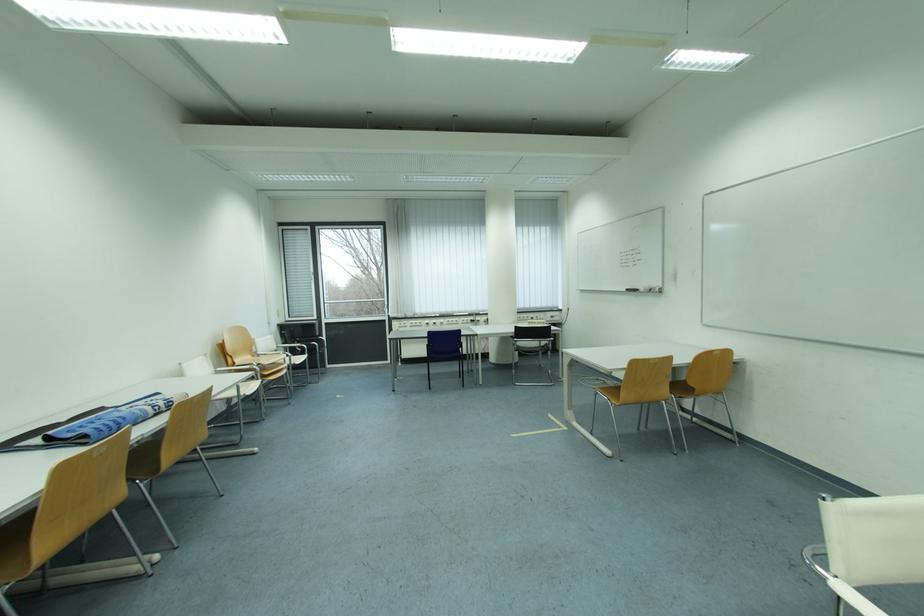
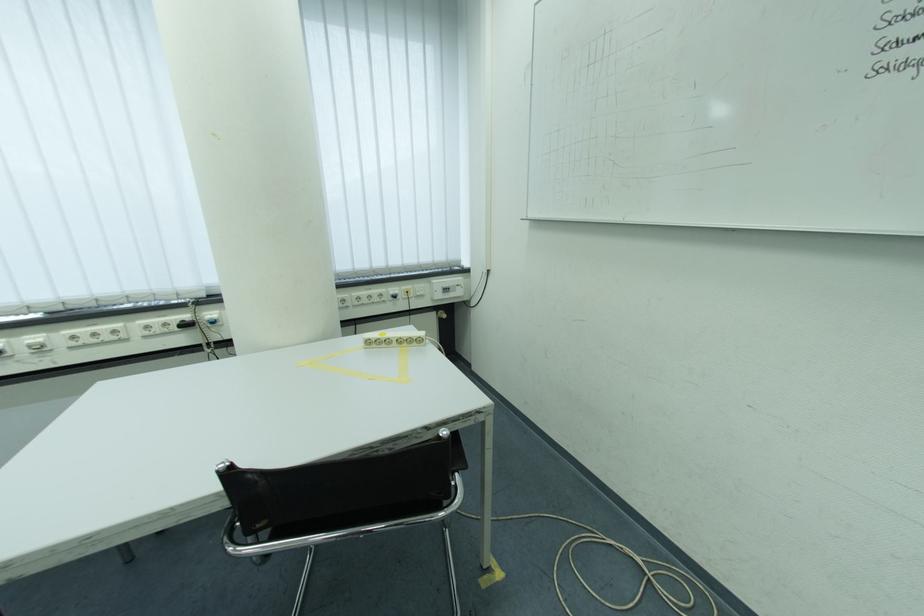
In the second image, find the point that corresponds to [561,320] in the first image.

(455, 292)